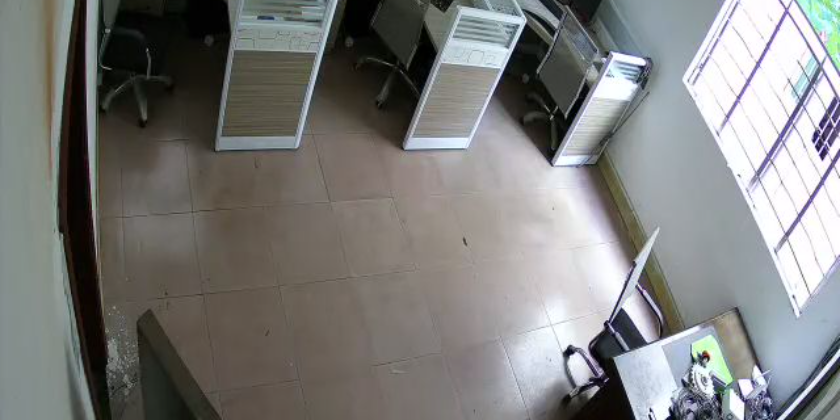
Find the location of a particular element. The width and height of the screenshot is (840, 420). desk mat is located at coordinates (674, 363).